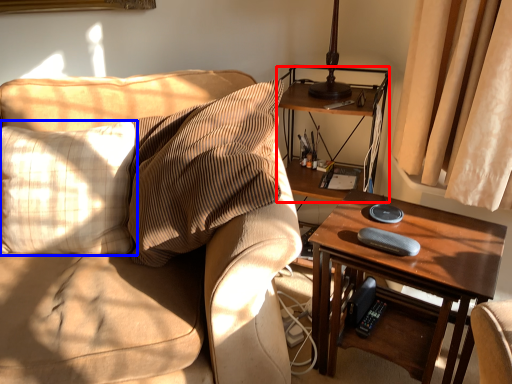
Question: Which object appears closest to the camera in this image, shelf (highlighted by a red box) or pillow (highlighted by a blue box)?

Choices:
 (A) shelf
 (B) pillow

Answer: (B)